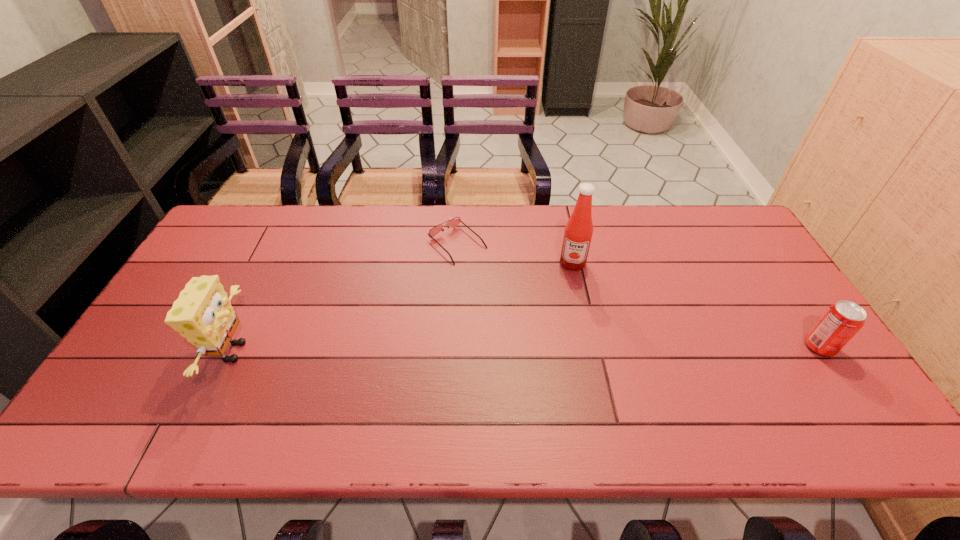
Find the location of a particular element. Image resolution: width=960 pixels, height=540 pixels. sponge is located at coordinates (202, 314).

This screenshot has width=960, height=540. Identify the location of the third shortest object. (202, 314).

Where is `the rightmost object`? This screenshot has width=960, height=540. the rightmost object is located at coordinates (841, 321).

Where is `the third tallest object`? The width and height of the screenshot is (960, 540). the third tallest object is located at coordinates (841, 321).

I want to click on the third object from right to left, so click(x=452, y=223).

At what (x,y) coordinates should I click in order to perform the action: click on the shortest object. Please return your answer as a coordinate pair (x, y). Looking at the image, I should click on (452, 223).

Identify the location of the tallest object. The image size is (960, 540). (578, 232).

Where is `the second object from right to left`? the second object from right to left is located at coordinates (578, 232).

Where is `vacant position located on the face of the sponge`? Image resolution: width=960 pixels, height=540 pixels. vacant position located on the face of the sponge is located at coordinates (343, 352).

Where is `free location located 0.320m on the back of the soda`? The height and width of the screenshot is (540, 960). free location located 0.320m on the back of the soda is located at coordinates (757, 254).